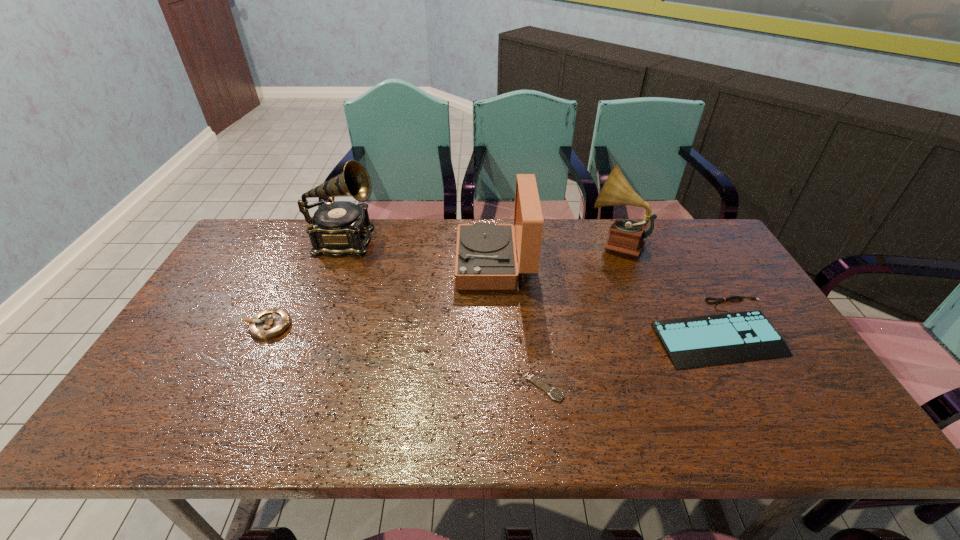
I want to click on the leftmost phonograph record, so click(x=338, y=228).

This screenshot has width=960, height=540. Find the location of `the rightmost phonograph record`. the rightmost phonograph record is located at coordinates (626, 236).

Where is `the second phonograph record from left to right`? This screenshot has width=960, height=540. the second phonograph record from left to right is located at coordinates (486, 259).

Find the location of a particular element. This screenshot has width=960, height=540. ashtray is located at coordinates coord(270,323).

This screenshot has width=960, height=540. In order to click on computer keyboard in this screenshot , I will do `click(691, 342)`.

This screenshot has width=960, height=540. Find the location of `the shortest object`. the shortest object is located at coordinates (555, 394).

I want to click on the nearest object, so tap(555, 394).

The height and width of the screenshot is (540, 960). In order to click on vacant space situated on the horn of the leftmost phonograph record in this screenshot , I will do `click(474, 241)`.

Locate an element on the screen. The image size is (960, 540). vacant space positioned on the horn of the rightmost phonograph record is located at coordinates pyautogui.click(x=511, y=242).

Identify the location of vacant space located on the horn of the rightmost phonograph record. (478, 242).